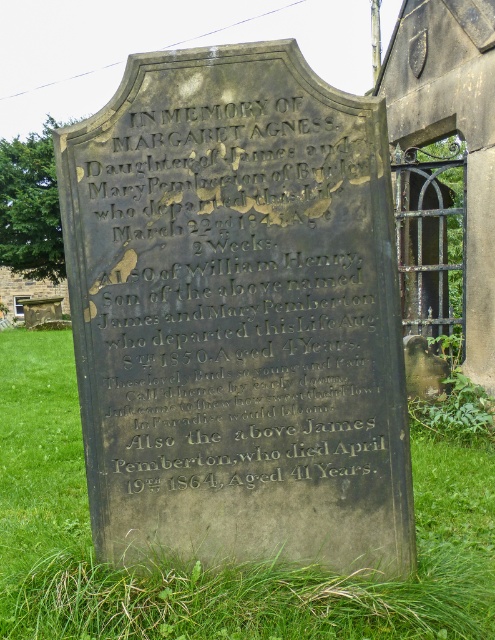
Question: Is the position of black stone inscription at center less distant than that of green grass at lower center?

Choices:
 (A) yes
 (B) no

Answer: (A)

Question: Does black stone inscription at center have a smaller size compared to green grass at lower center?

Choices:
 (A) no
 (B) yes

Answer: (A)

Question: Does black stone inscription at center appear under green grass at lower center?

Choices:
 (A) no
 (B) yes

Answer: (A)

Question: Which object is closer to the camera taking this photo?

Choices:
 (A) green grass at lower center
 (B) black stone inscription at center

Answer: (B)

Question: Which object is farther from the camera taking this photo?

Choices:
 (A) green grass at lower center
 (B) black stone inscription at center

Answer: (A)